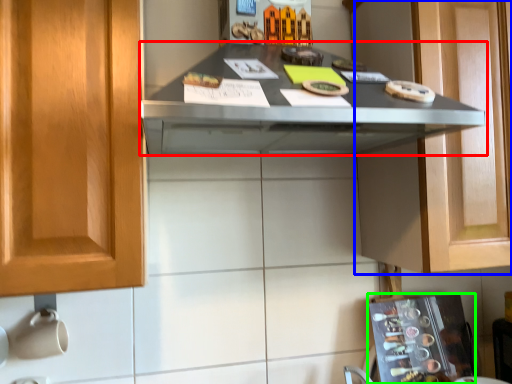
Question: Estimate the real-world distances between objects in this image. Which object is farther from countertop (highlighted by a red box), cabinetry (highlighted by a blue box) or appliance (highlighted by a green box)?

Choices:
 (A) cabinetry
 (B) appliance

Answer: (B)